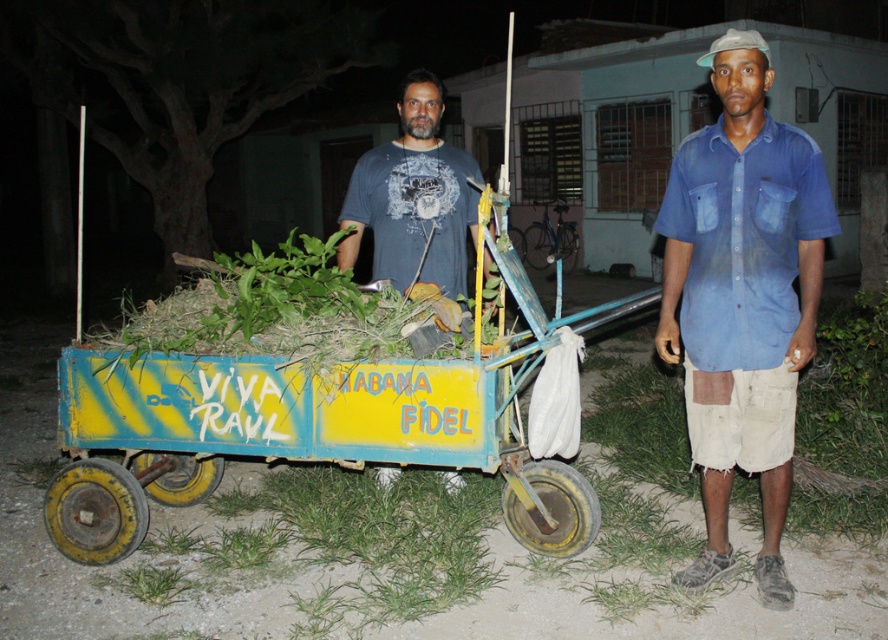
Question: Is yellow painted wood wagon at center wider than blue denim shirt at center?

Choices:
 (A) yes
 (B) no

Answer: (A)

Question: Can you confirm if blue denim shirt at center is positioned below dark blue t-shirt at center?

Choices:
 (A) no
 (B) yes

Answer: (B)

Question: Which point is farther to the camera?

Choices:
 (A) dark blue t-shirt at center
 (B) yellow painted wood wagon at center

Answer: (A)

Question: Is yellow painted wood wagon at center thinner than blue denim shirt at center?

Choices:
 (A) yes
 (B) no

Answer: (B)

Question: Which point is farther to the camera?

Choices:
 (A) yellow painted wood wagon at center
 (B) blue denim shirt at center
 (C) dark blue t-shirt at center

Answer: (C)

Question: Which object is positioned farthest from the dark blue t-shirt at center?

Choices:
 (A) blue denim shirt at center
 (B) yellow painted wood wagon at center

Answer: (A)